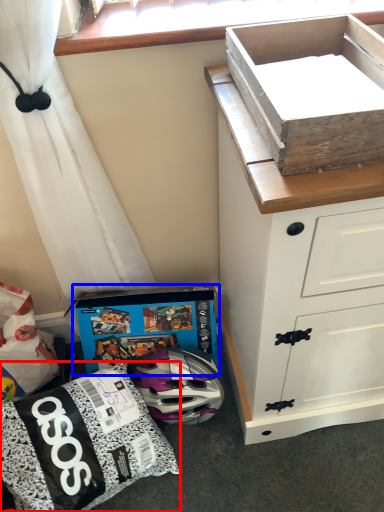
Question: Which of the following is the farthest to the observer, kit (highlighted by a red box) or cardboard box (highlighted by a blue box)?

Choices:
 (A) kit
 (B) cardboard box

Answer: (B)